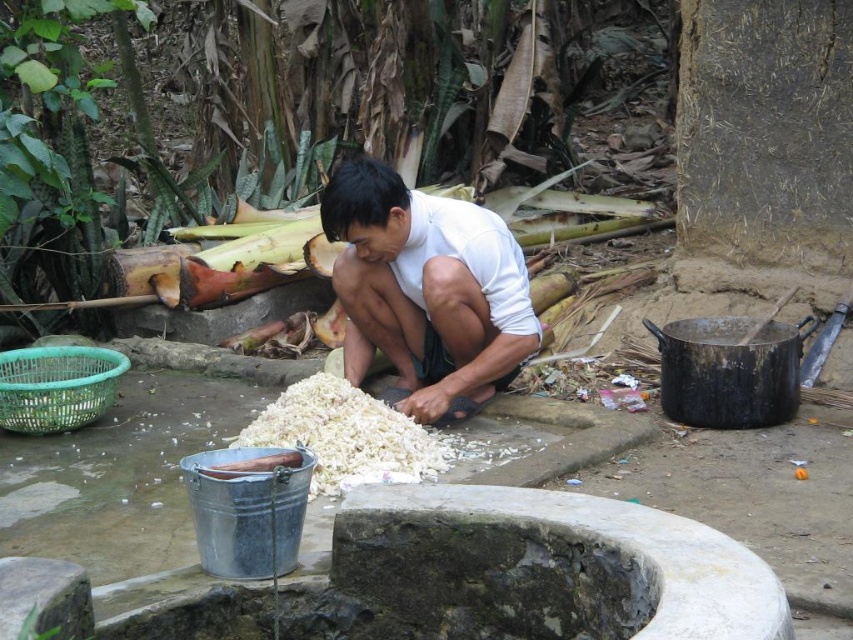
Question: Can you confirm if white matte shirt at center is positioned above white fluffy food at center?

Choices:
 (A) yes
 (B) no

Answer: (A)

Question: Is white matte shirt at center thinner than white fluffy food at center?

Choices:
 (A) yes
 (B) no

Answer: (A)

Question: Is white matte shirt at center above white fluffy food at center?

Choices:
 (A) yes
 (B) no

Answer: (A)

Question: Which point is farther to the camera?

Choices:
 (A) white fluffy food at center
 (B) white matte shirt at center

Answer: (B)

Question: Which object is farther from the camera taking this photo?

Choices:
 (A) white fluffy food at center
 (B) white matte shirt at center

Answer: (B)